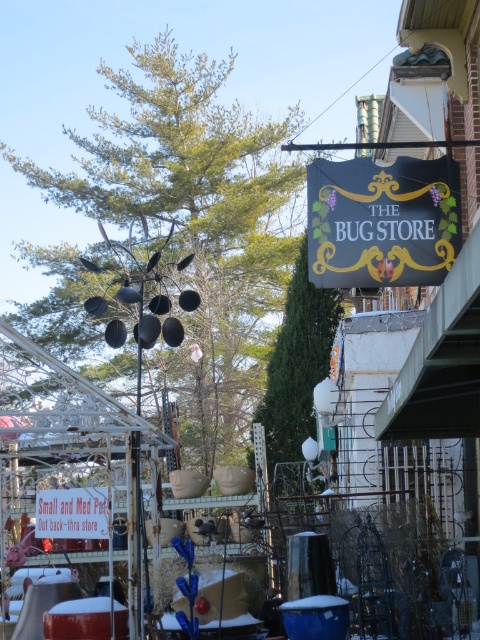
Question: Which of the following is the closest to the observer?

Choices:
 (A) black fabric sign at upper center
 (B) red plastic sign at lower left

Answer: (A)

Question: Observing the image, what is the correct spatial positioning of black fabric sign at upper center in reference to red plastic sign at lower left?

Choices:
 (A) above
 (B) below

Answer: (A)

Question: Which object is farther from the camera taking this photo?

Choices:
 (A) black fabric sign at upper center
 (B) red plastic sign at lower left

Answer: (B)

Question: Is black fabric sign at upper center further to camera compared to red plastic sign at lower left?

Choices:
 (A) no
 (B) yes

Answer: (A)

Question: Is black fabric sign at upper center to the left of red plastic sign at lower left from the viewer's perspective?

Choices:
 (A) no
 (B) yes

Answer: (A)